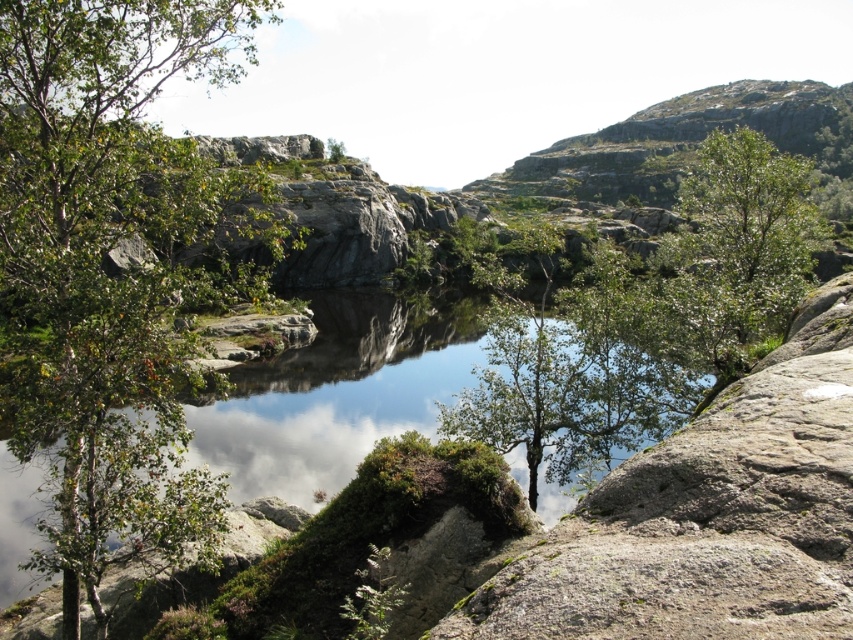
You are standing at the center of the scene. Which direction should you walk to reach the green leafy tree at left?

The green leafy tree at left is located to your left side, so you should walk towards the left to reach it.

You are standing in the middle of the rocky terrain and want to take a photo of both the green leafy tree at left and the green leafy tree at upper right. Which tree will require you to zoom in more to capture its full width in the photo?

The green leafy tree at left has a lesser width compared to the green leafy tree at upper right, so you will need to zoom in more to capture the full width of the green leafy tree at left.